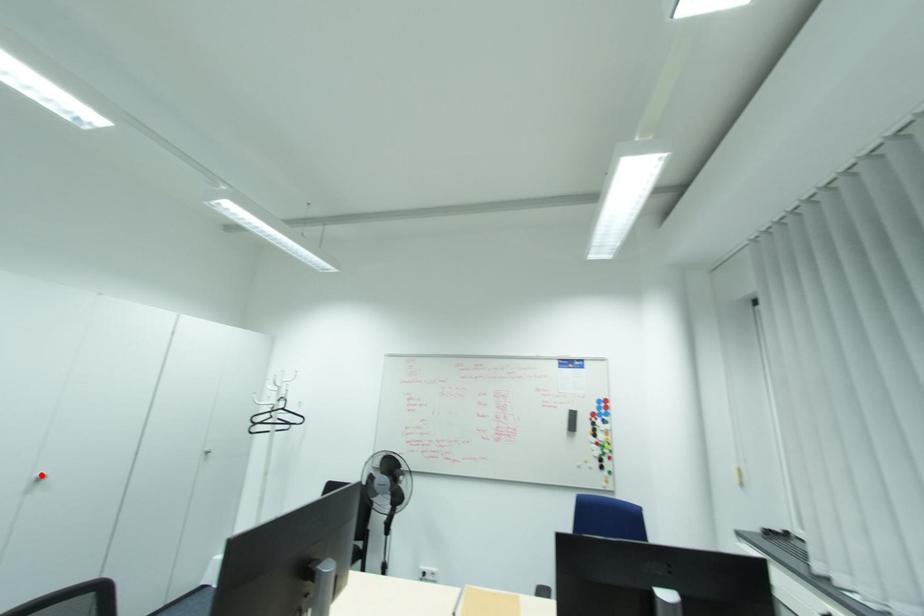
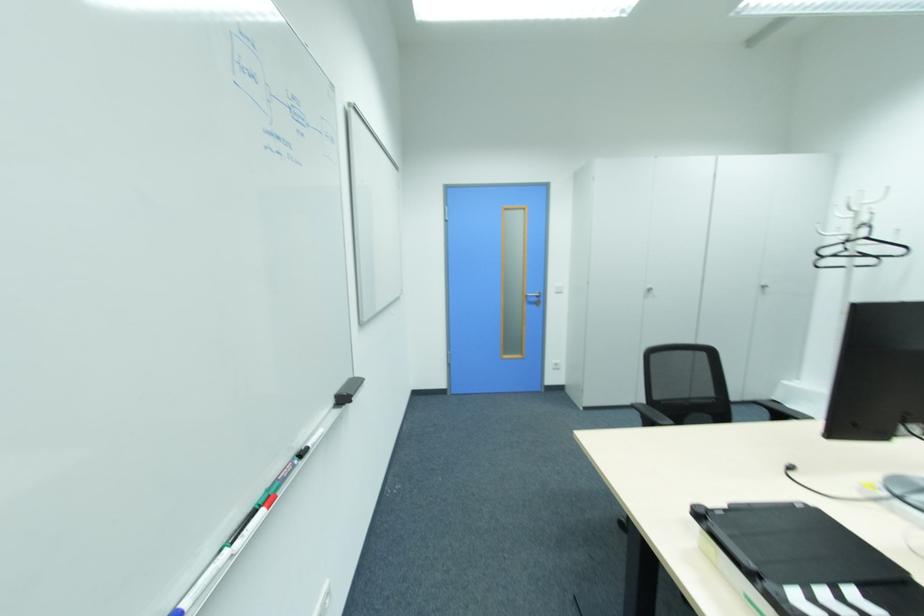
Question: I am providing you with two images of the same scene from different viewpoints. Image1 has a red point marked. In image2, the corresponding 3D location appears at what relative position? Reply with the corresponding letter.

Choices:
 (A) Closer
 (B) Farther

Answer: (B)